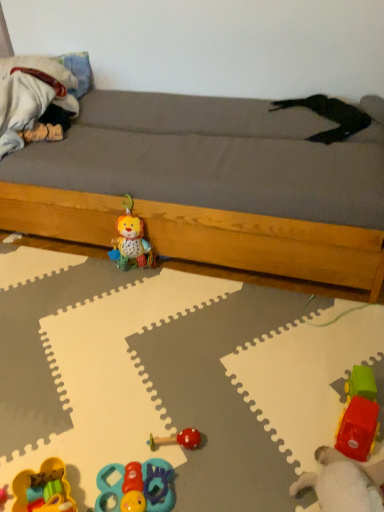
Identify the location of vacant space situated on the left part of rubberized plastic truck at lower right, marked as the 1th toy in a right-to-left arrangement. This screenshot has width=384, height=512. (297, 408).